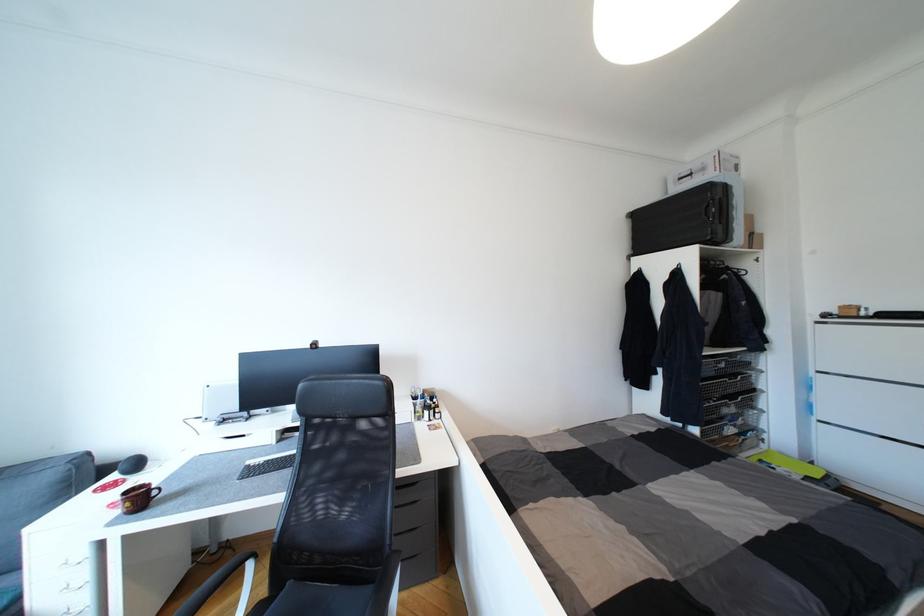
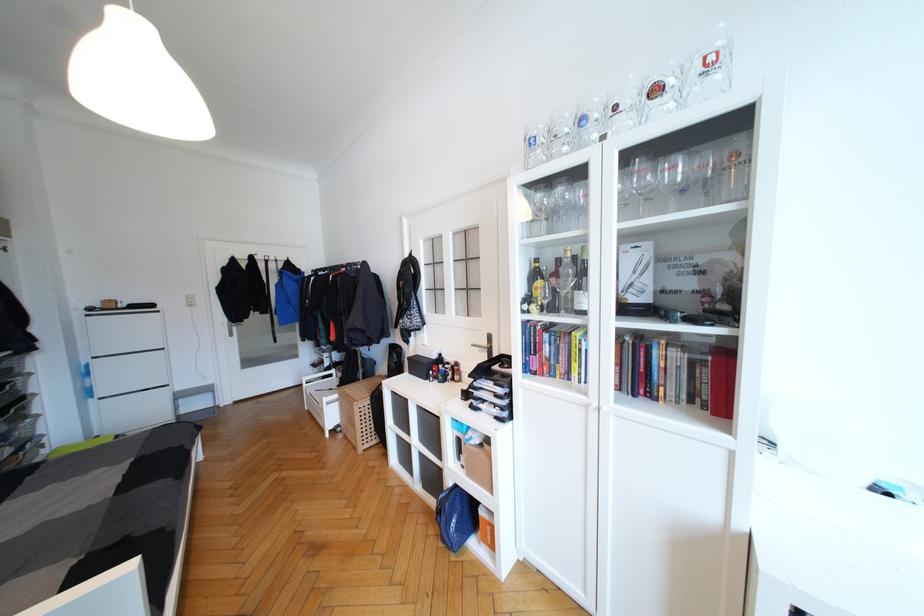
In the second image, find the point that corresponds to [821,323] in the first image.

(91, 317)